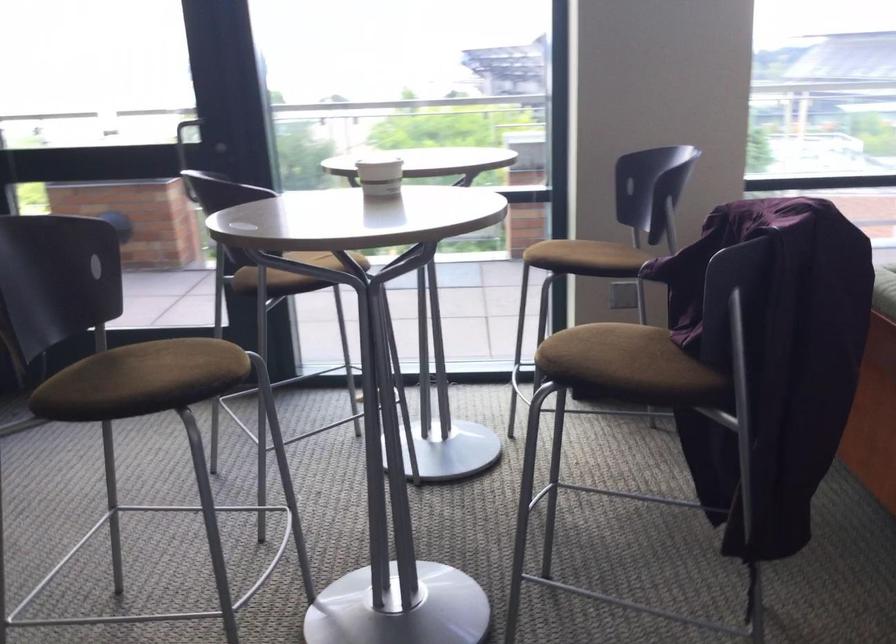
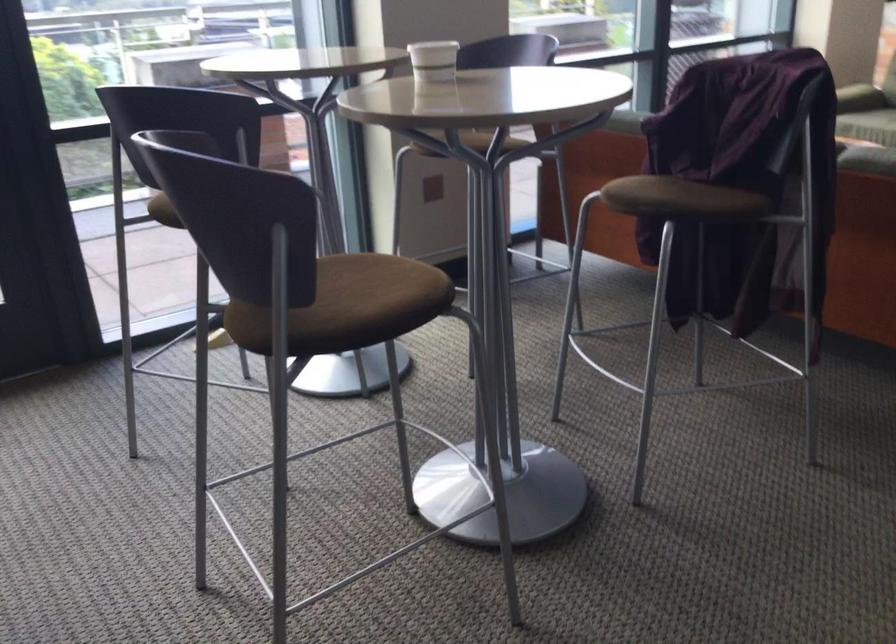
In the second image, find the point that corresponds to (x=159, y=372) in the first image.

(371, 292)